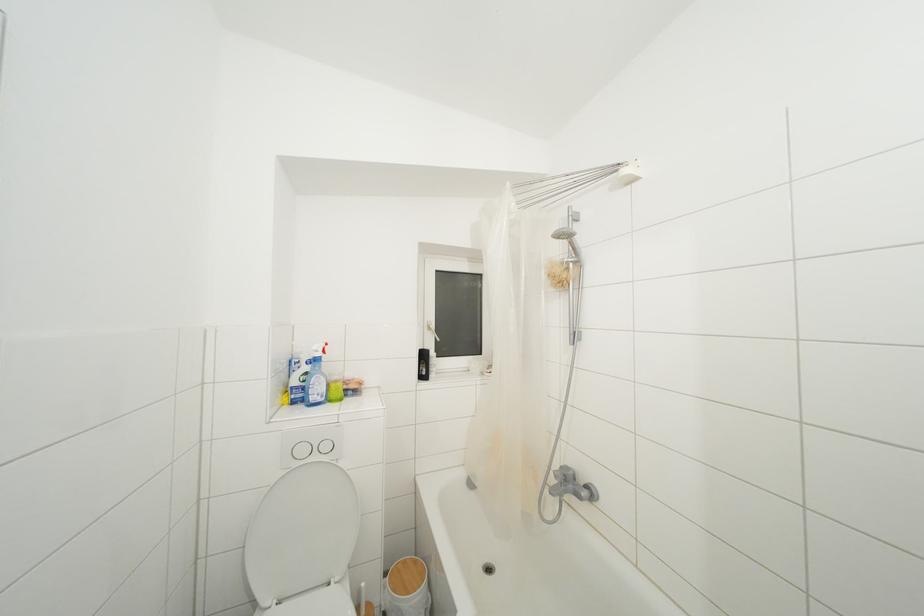
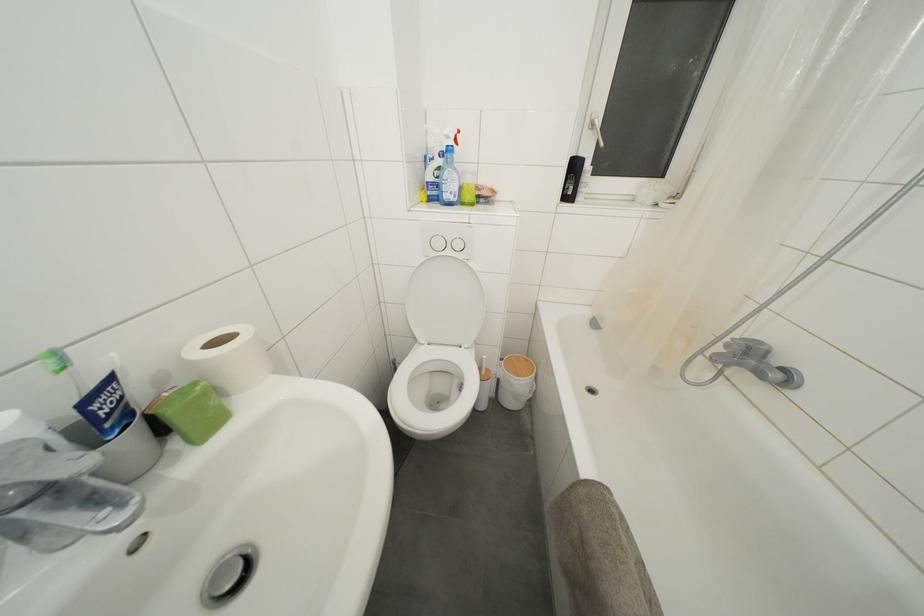
Consider the image. First-person continuous shooting, in which direction is the camera rotating?

The rotation direction of the camera is left-down.